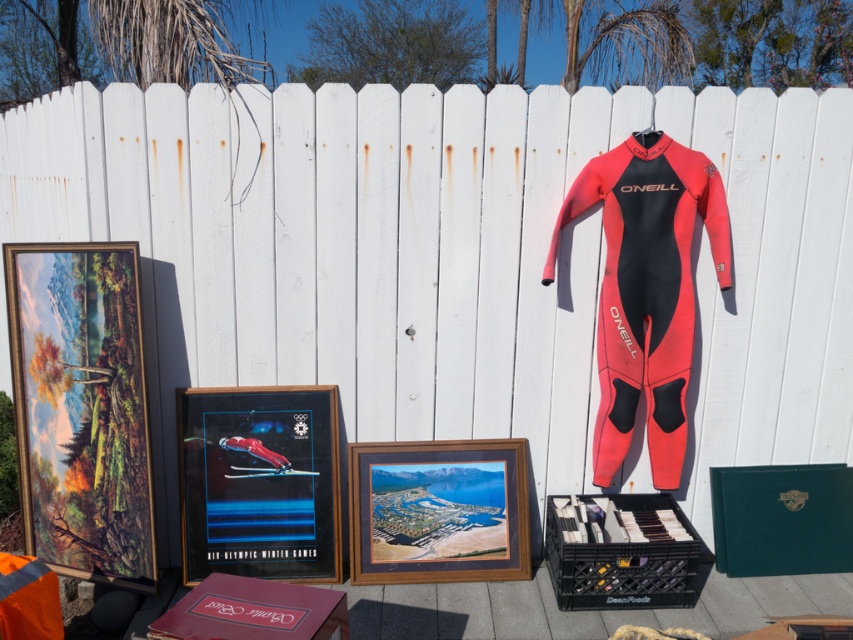
Is red neoprene wetsuit at right taller than matte plastic picture frame at center?

Yes, red neoprene wetsuit at right is taller than matte plastic picture frame at center.

Can you confirm if red neoprene wetsuit at right is positioned below matte plastic picture frame at center?

Actually, red neoprene wetsuit at right is above matte plastic picture frame at center.

Identify the location of red neoprene wetsuit at right. (646, 289).

Which is above, matte wooden picture frame at left or wooden framed photo at center?

matte wooden picture frame at left is above.

Is matte wooden picture frame at left below wooden framed photo at center?

No.

Image resolution: width=853 pixels, height=640 pixels. What do you see at coordinates (80, 410) in the screenshot?
I see `matte wooden picture frame at left` at bounding box center [80, 410].

I want to click on matte wooden picture frame at left, so click(80, 410).

Which is more to the left, matte wooden picture frame at left or matte plastic picture frame at center?

Positioned to the left is matte wooden picture frame at left.

What do you see at coordinates (80, 410) in the screenshot? Image resolution: width=853 pixels, height=640 pixels. I see `matte wooden picture frame at left` at bounding box center [80, 410].

Locate an element on the screen. The height and width of the screenshot is (640, 853). matte wooden picture frame at left is located at coordinates (80, 410).